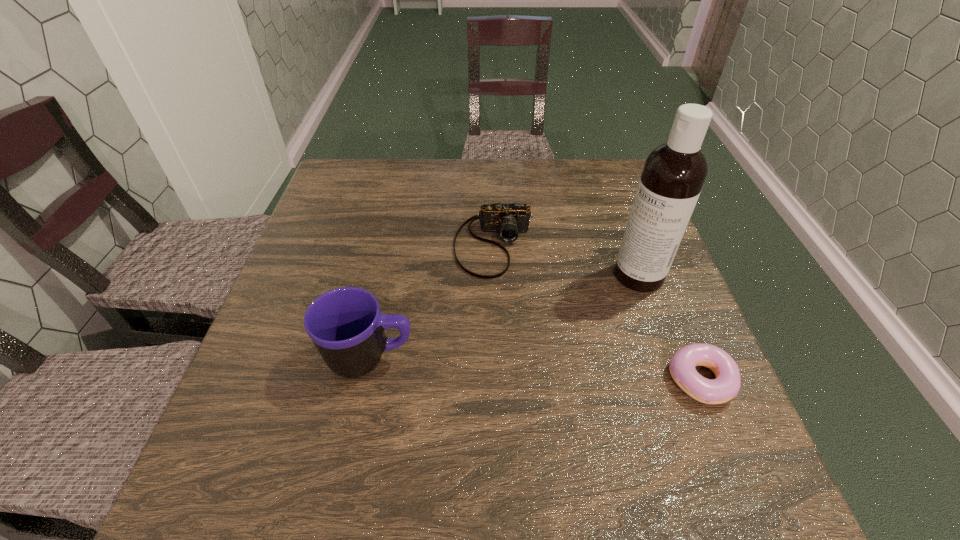
Identify the location of vacant space at the near edge. The width and height of the screenshot is (960, 540). (355, 435).

In the image, there is a desktop. Identify the location of vacant space at the left edge. (313, 255).

This screenshot has height=540, width=960. Find the location of `free point at the right edge`. free point at the right edge is located at coordinates (606, 269).

Identify the location of free region at the far left corner of the desktop. This screenshot has height=540, width=960. (372, 164).

Locate an element on the screen. This screenshot has width=960, height=540. free space at the near left corner of the desktop is located at coordinates (289, 443).

The width and height of the screenshot is (960, 540). I want to click on vacant space at the near right corner of the desktop, so click(728, 419).

You are a GUI agent. You are given a task and a screenshot of the screen. Output one action in this format:
    pyautogui.click(x=<x>, y=<y>)
    Task: Click on the free space between the shortest object and the mug
    
    Given the screenshot: What is the action you would take?
    pyautogui.click(x=535, y=369)

Locate an element on the screen. vacant area between the tallest object and the doughnut is located at coordinates (669, 328).

At what (x,y) coordinates should I click in order to perform the action: click on vacant area that lies between the second tallest object and the tallest object. Please return your answer as a coordinate pair (x, y). Looking at the image, I should click on (504, 317).

I want to click on free area in between the shortest object and the second tallest object, so click(x=535, y=369).